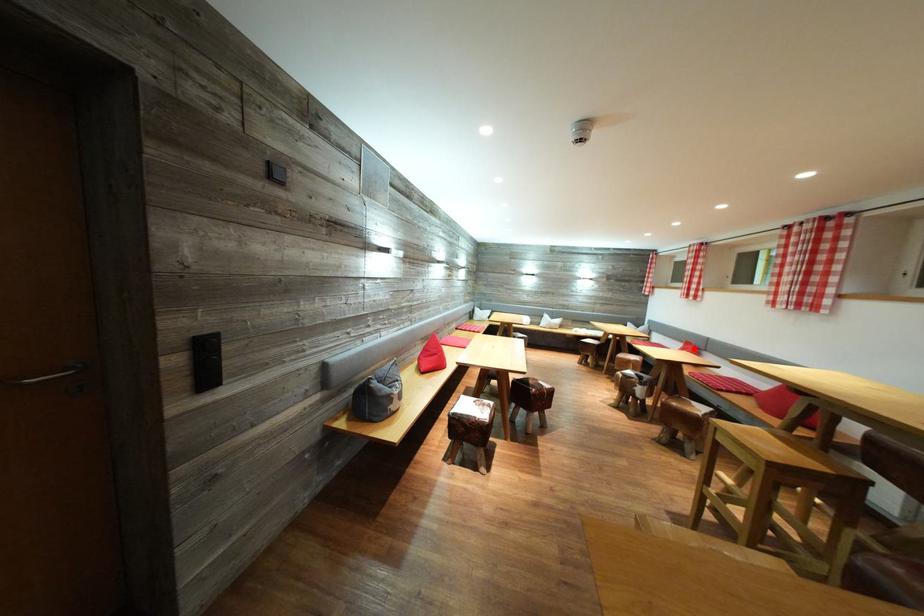
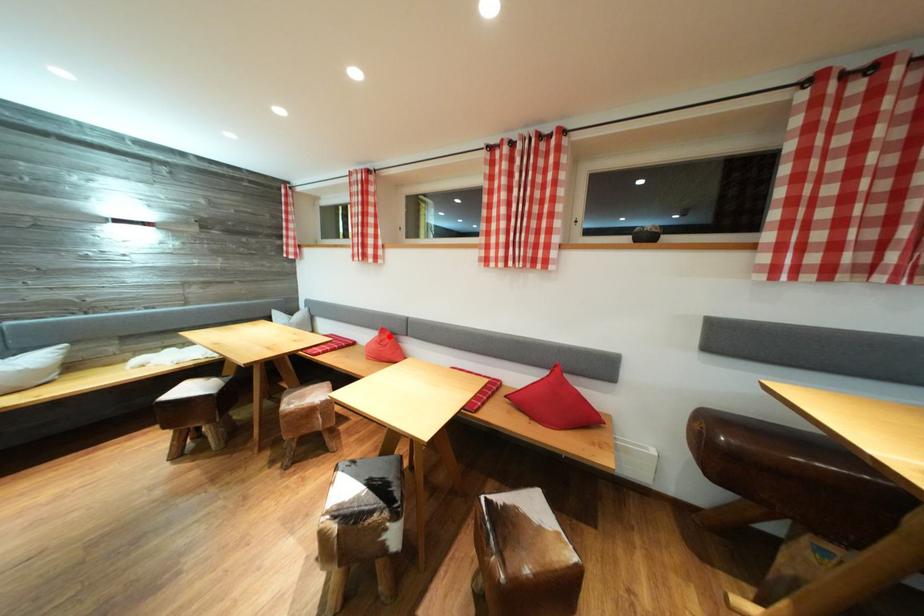
Based on the photo, I am providing you with two images of the same scene from different viewpoints. A red point is marked on the first image and another point is marked on the second image. Is the red point in image1 aligned with the point shown in image2?

Yes